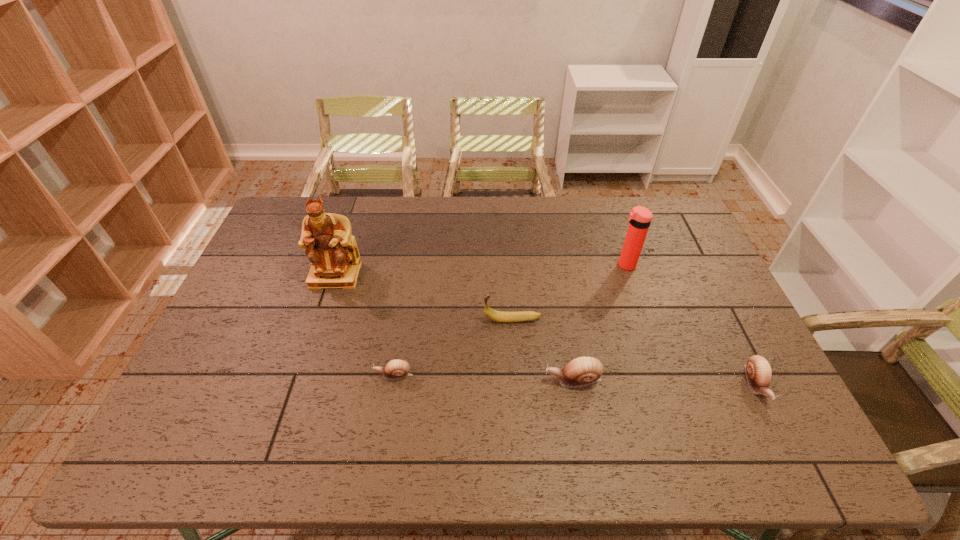
I want to click on vacant place for an extra escargot on the left, so click(x=218, y=370).